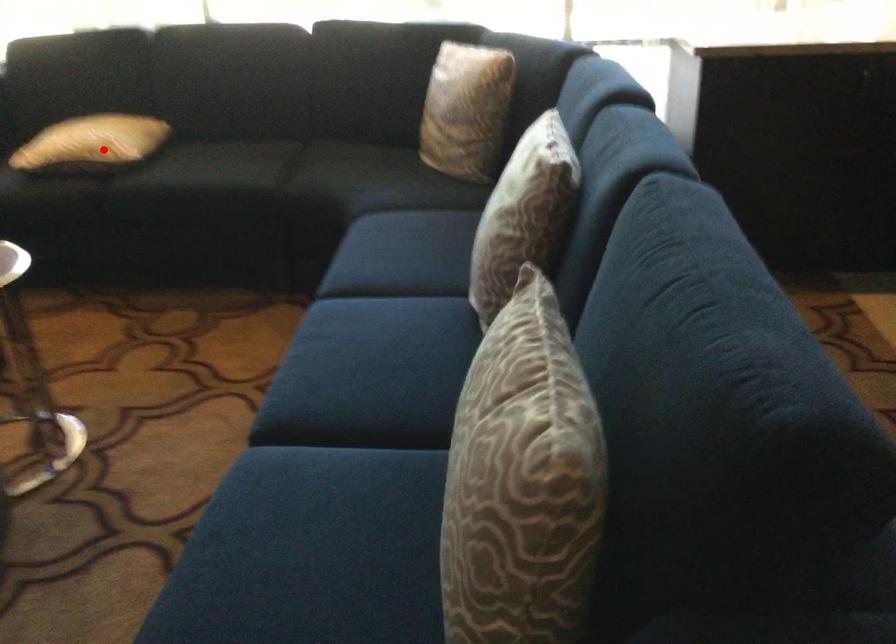
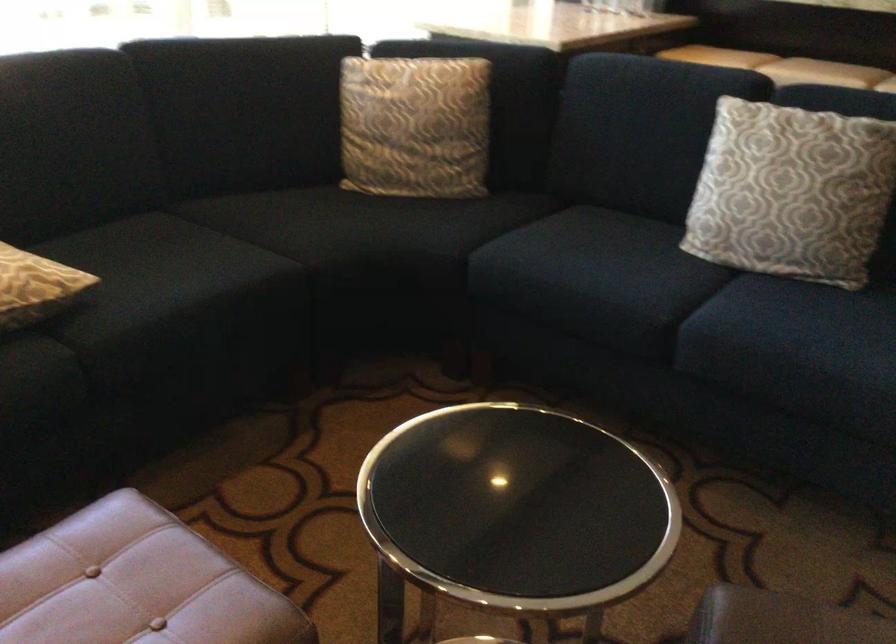
Question: I am providing you with two images of the same scene from different viewpoints. In image1, a red point is highlighted. Considering the same 3D point in image2, which of the following is correct?

Choices:
 (A) It is closer
 (B) It is farther

Answer: (A)